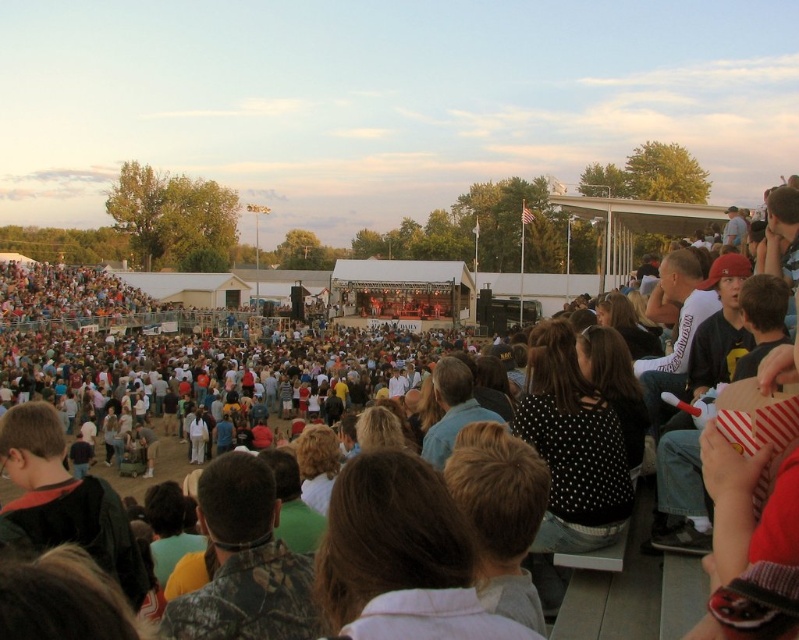
Does point (113, 381) lie behind point (454, 440)?

That is True.

Which is below, matte black stage at center or dark brown hair at center?

dark brown hair at center

Locate an element on the screen. matte black stage at center is located at coordinates (211, 385).

Identify the location of matte black stage at center. tap(211, 385).

Can you confirm if matte black stage at center is positioned to the left of camouflage shirt at center?

Correct, you'll find matte black stage at center to the left of camouflage shirt at center.

Who is taller, matte black stage at center or camouflage shirt at center?

matte black stage at center

At what (x,y) coordinates should I click in order to perform the action: click on matte black stage at center. Please return your answer as a coordinate pair (x, y). The height and width of the screenshot is (640, 799). Looking at the image, I should click on (211, 385).

Does dark brown hair at center appear over white cotton shirt at center?

Correct, dark brown hair at center is located above white cotton shirt at center.

Is dark brown hair at center wider than white cotton shirt at center?

Yes, dark brown hair at center is wider than white cotton shirt at center.

Is point (450, 397) positioned behind point (205, 438)?

No, (450, 397) is closer to viewer.

Where is `dark brown hair at center`? This screenshot has width=799, height=640. dark brown hair at center is located at coordinates (452, 410).